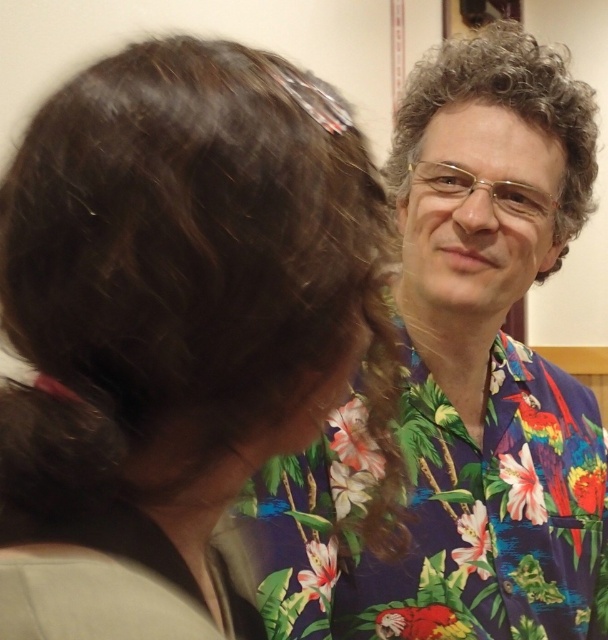
You are a photographer trying to capture a portrait of the two people in the scene. You need to ensure that both the floral shirt at upper right and the curly brown hair at upper right are clearly visible in the frame. Based on their relative sizes in the image, which object should you focus on to ensure both are in focus?

The floral shirt at upper right is much taller than the curly brown hair at upper right, so focusing on the floral shirt at upper right will help ensure both are in focus since it is larger and likely closer to the camera.

You are designing a poster and need to place text next to both the dark brown hair at upper left and the curly brown hair at upper right. Which hair should you place text closer to if you want the text to be smaller but still readable?

You should place the smaller text next to the dark brown hair at upper left because it has a lesser width, allowing the text to remain readable without overlapping the narrower area.

Looking at this image, you are standing at the point with coordinates point [547,632] and want to walk to the point with coordinates point [570,113]. Given that the two points are on the same path, will you have to walk forward or backward to reach your destination?

Since point [547,632] is behind point [570,113], you will have to walk forward to reach the destination from point [547,632].